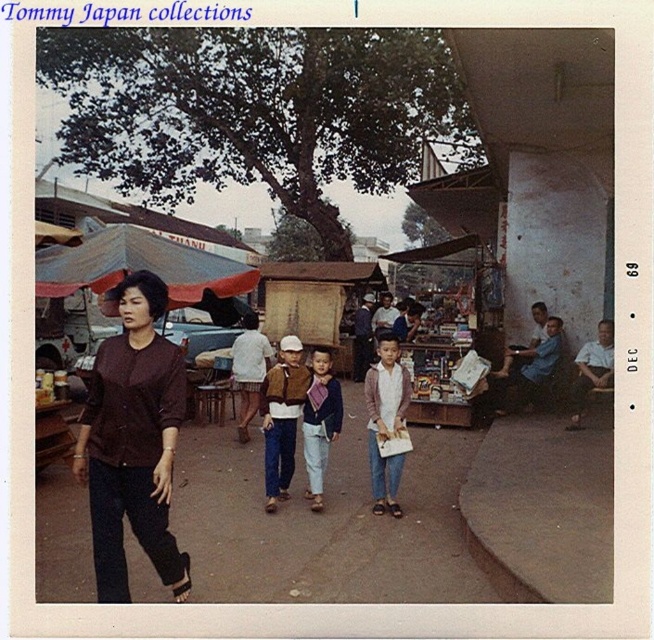
Is brown fabric shirt at center positioned at the back of dark brown leather jacket at center?

That is False.

Looking at this image, is brown fabric shirt at center bigger than dark brown leather jacket at center?

Yes, brown fabric shirt at center is bigger than dark brown leather jacket at center.

Find the location of a particular element. brown fabric shirt at center is located at coordinates (133, 442).